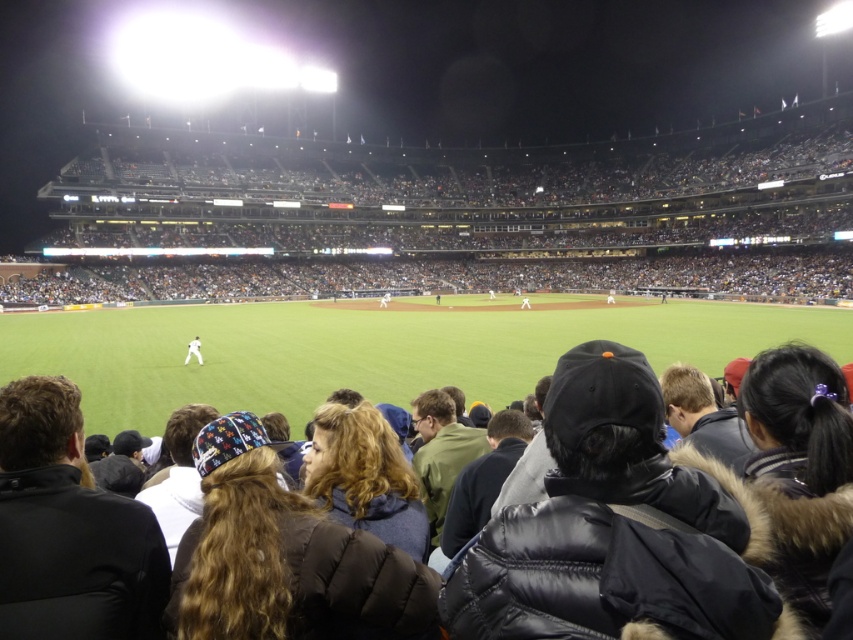
Which of these two, black puffy coat at center or white matte baseball player at center, stands taller?

With more height is black puffy coat at center.

Can you confirm if black puffy coat at center is thinner than white matte baseball player at center?

No, black puffy coat at center is not thinner than white matte baseball player at center.

This screenshot has width=853, height=640. What do you see at coordinates (666, 509) in the screenshot?
I see `black puffy coat at center` at bounding box center [666, 509].

The width and height of the screenshot is (853, 640). In order to click on black puffy coat at center in this screenshot , I will do `click(666, 509)`.